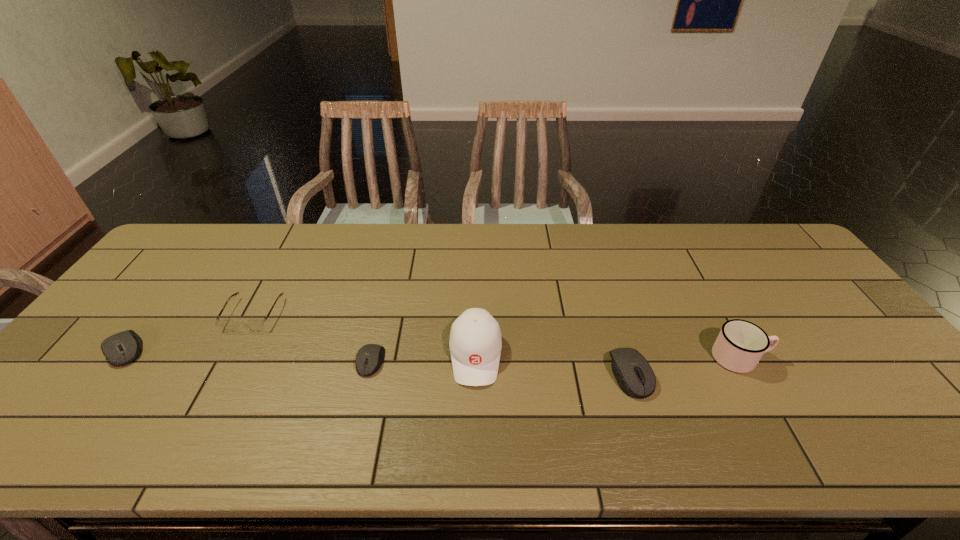
Find the location of `blank space at the right edge of the desktop`. blank space at the right edge of the desktop is located at coordinates (845, 343).

This screenshot has height=540, width=960. In the image, there is a desktop. In order to click on vacant space at the far right corner in this screenshot , I will do `click(760, 232)`.

At what (x,y) coordinates should I click in order to perform the action: click on empty space that is in between the third object from right to left and the mug. Please return your answer as a coordinate pair (x, y). The width and height of the screenshot is (960, 540). Looking at the image, I should click on (608, 356).

Find the location of `free point between the fourth object from left to right and the second tallest computer equipment`. free point between the fourth object from left to right and the second tallest computer equipment is located at coordinates (300, 352).

I want to click on vacant space that's between the fifth object from right to left and the fourth object from left to right, so click(x=365, y=335).

Identify the location of vacant point located between the fourth object from right to left and the third object from right to left. This screenshot has height=540, width=960. (423, 359).

Where is `vacant area between the third object from right to left and the second object from right to left`? Image resolution: width=960 pixels, height=540 pixels. vacant area between the third object from right to left and the second object from right to left is located at coordinates (553, 364).

Identify the location of vacant point located between the baseball cap and the rightmost object. This screenshot has height=540, width=960. (608, 356).

Where is `vacant space that's between the tallest computer equipment and the rightmost object`? The height and width of the screenshot is (540, 960). vacant space that's between the tallest computer equipment and the rightmost object is located at coordinates (684, 366).

This screenshot has width=960, height=540. I want to click on free space that is in between the mug and the fourth object from left to right, so click(x=608, y=356).